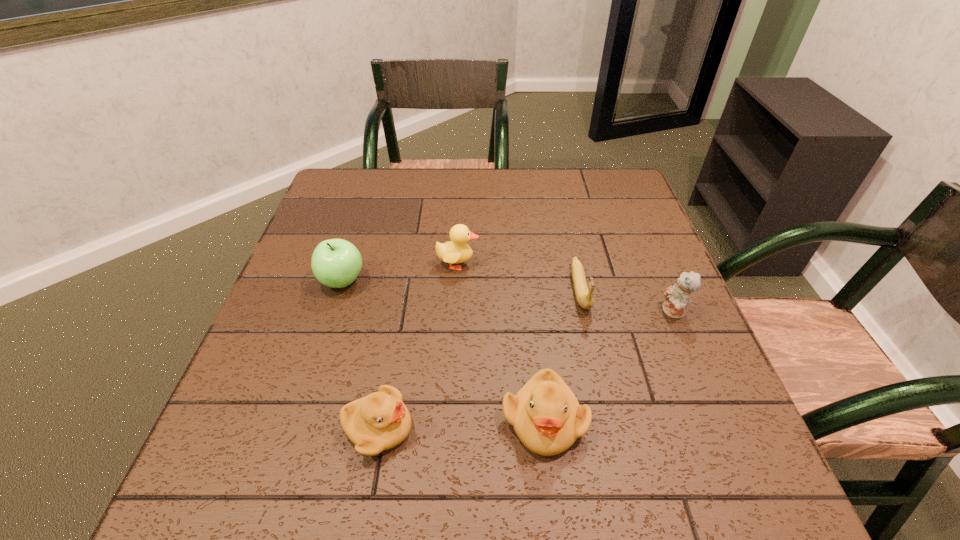
Locate an element on the screen. This screenshot has width=960, height=540. vacant area that lies between the leftmost duckling and the leftmost object is located at coordinates (360, 355).

I want to click on free space between the teddy bear and the shortest duckling, so click(x=526, y=370).

Where is `vacant area between the fourth object from right to left and the fifth object from right to left`? This screenshot has width=960, height=540. vacant area between the fourth object from right to left and the fifth object from right to left is located at coordinates (418, 346).

Identify the location of empty location between the farthest duckling and the third object from right to left. Image resolution: width=960 pixels, height=540 pixels. (501, 342).

Select which object appears as the fifth closest to the second duckling from left to right. Please provide its 2D coordinates. Your answer should be formatted as a tuple, i.e. [(x, y)], where the tuple contains the x and y coordinates of a point satisfying the conditions above.

[(677, 297)]

Locate an element on the screen. This screenshot has height=540, width=960. object that is the second closest one to the leftmost object is located at coordinates (380, 421).

Where is `the second closest duckling to the third object from right to left`? The width and height of the screenshot is (960, 540). the second closest duckling to the third object from right to left is located at coordinates tap(456, 251).

Select which duckling is the third closest to the banana. Please provide its 2D coordinates. Your answer should be formatted as a tuple, i.e. [(x, y)], where the tuple contains the x and y coordinates of a point satisfying the conditions above.

[(380, 421)]

Where is `free location that satisfies the following two spatial constraints: 1. on the front-facing side of the rightmost object; 2. on the front-facing side of the fourth object from left to right`? The width and height of the screenshot is (960, 540). free location that satisfies the following two spatial constraints: 1. on the front-facing side of the rightmost object; 2. on the front-facing side of the fourth object from left to right is located at coordinates (719, 420).

Where is `free location that satisfies the following two spatial constraints: 1. at the stem of the second object from right to left; 2. on the front-facing side of the leftmost duckling`? Image resolution: width=960 pixels, height=540 pixels. free location that satisfies the following two spatial constraints: 1. at the stem of the second object from right to left; 2. on the front-facing side of the leftmost duckling is located at coordinates (612, 428).